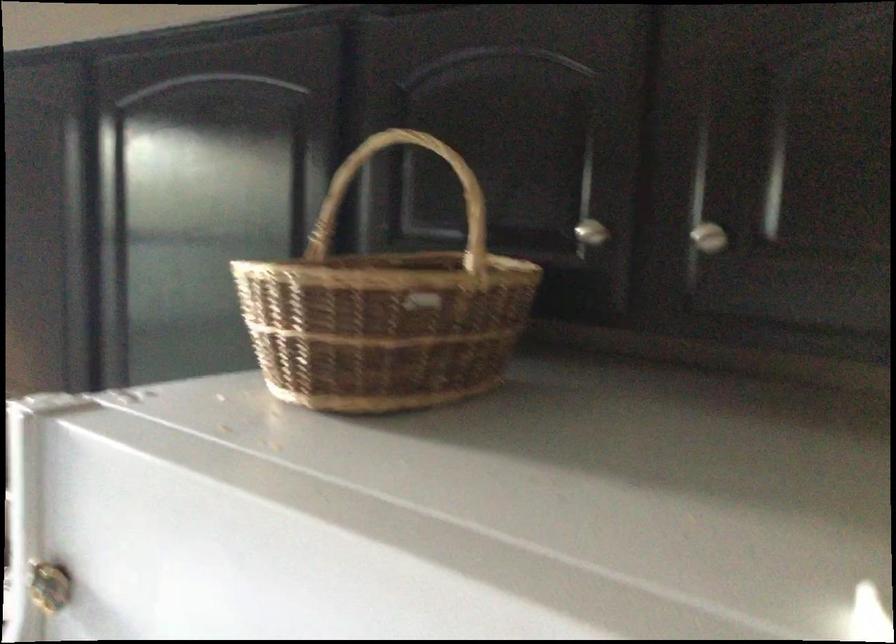
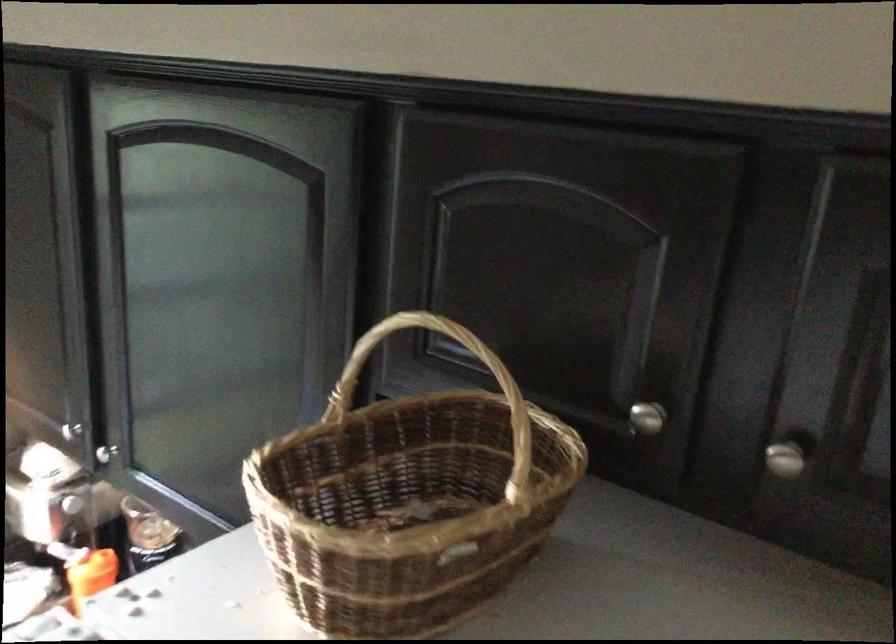
In a continuous first-person perspective shot, in which direction is the camera moving?

The cameraman walked toward left, forward.